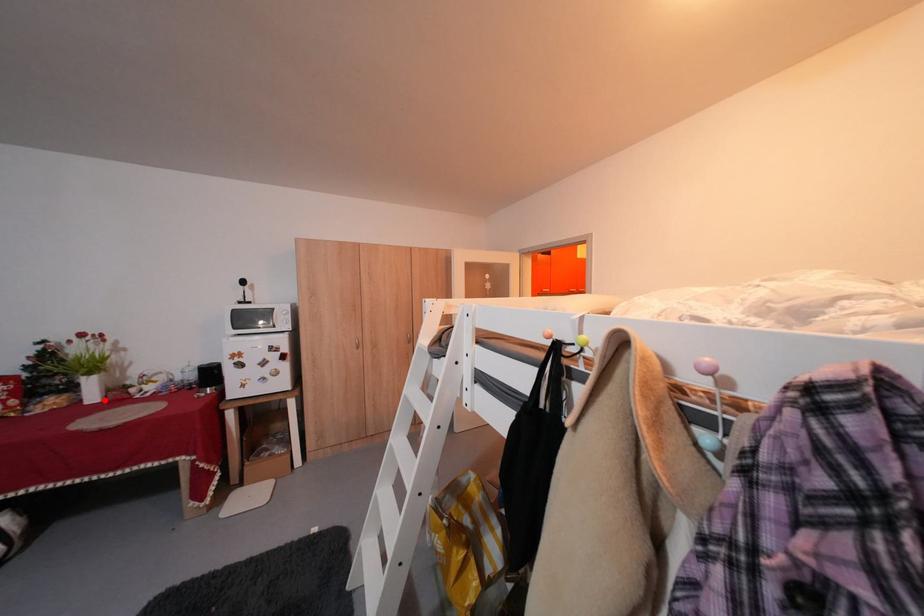
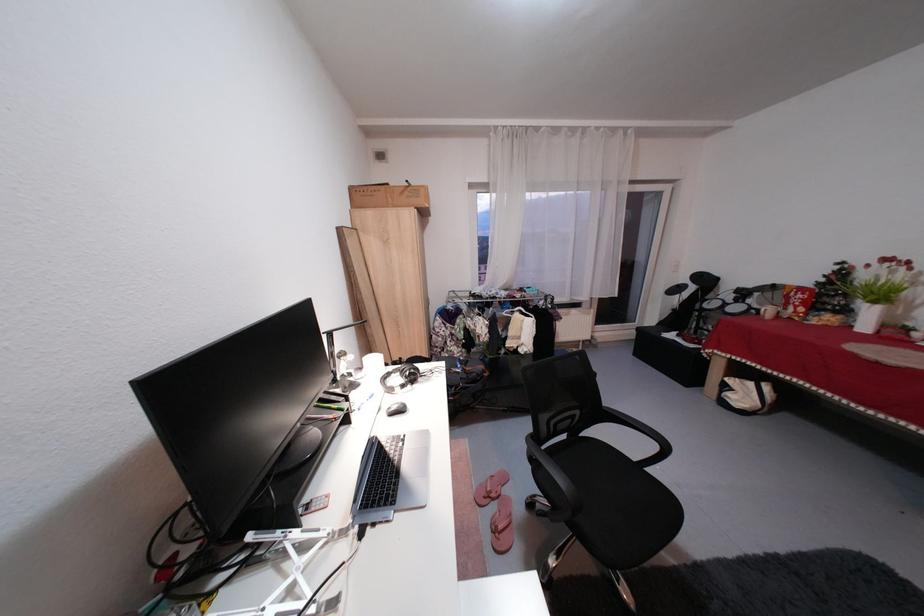
Where in the second image is the point corresponding to the highlighted location from the first image?

(877, 330)